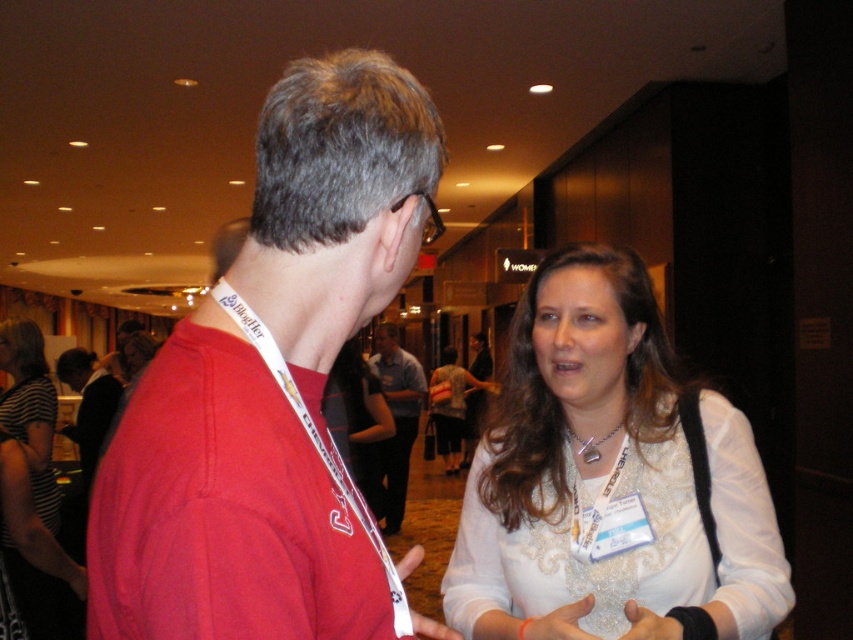
Question: Is white satin blouse at center closer to camera compared to striped fabric shirt at center?

Choices:
 (A) no
 (B) yes

Answer: (B)

Question: Which point appears closest to the camera in this image?

Choices:
 (A) coord(469,362)
 (B) coord(610,440)
 (C) coord(0,417)
 (D) coord(582,448)

Answer: (B)

Question: Which object is the closest to the white satin blouse at center?

Choices:
 (A) striped fabric shirt at center
 (B) matte red shirt at center

Answer: (B)

Question: Based on their relative distances, which object is nearer to the matte blue shirt at center?

Choices:
 (A) matte red shirt at center
 (B) striped fabric shirt at center

Answer: (B)

Question: Does matte red shirt at center have a greater width compared to striped fabric shirt at center?

Choices:
 (A) no
 (B) yes

Answer: (A)

Question: In this image, where is matte red shirt at center located relative to striped fabric shirt at center?

Choices:
 (A) left
 (B) right

Answer: (B)